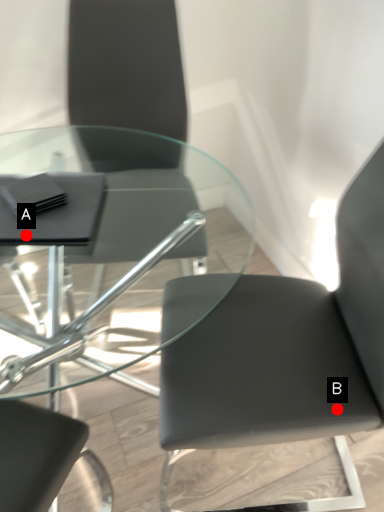
Question: Two points are circled on the image, labeled by A and B beside each circle. Which point appears closest to the camera in this image?

Choices:
 (A) A is closer
 (B) B is closer

Answer: (A)